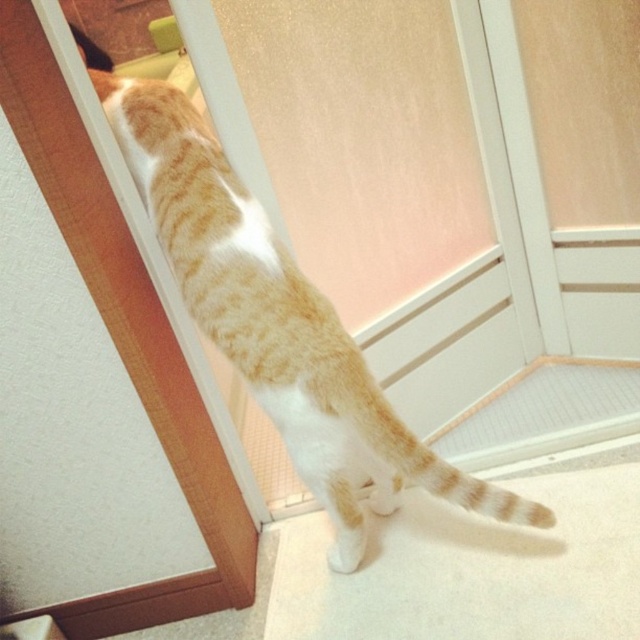
Question: Which of the following is the closest to the observer?

Choices:
 (A) (348, 364)
 (B) (173, 355)

Answer: (A)

Question: Can you confirm if orange tabby cat at center is positioned to the right of matte wood screen door at upper left?

Choices:
 (A) yes
 (B) no

Answer: (A)

Question: Is orange tabby cat at center wider than matte wood screen door at upper left?

Choices:
 (A) yes
 (B) no

Answer: (A)

Question: Which point is farther from the camera taking this photo?

Choices:
 (A) (337, 484)
 (B) (61, 113)

Answer: (A)

Question: Which point is closer to the camera?

Choices:
 (A) (307, 387)
 (B) (140, 596)

Answer: (A)

Question: Is orange tabby cat at center thinner than matte wood screen door at upper left?

Choices:
 (A) yes
 (B) no

Answer: (B)